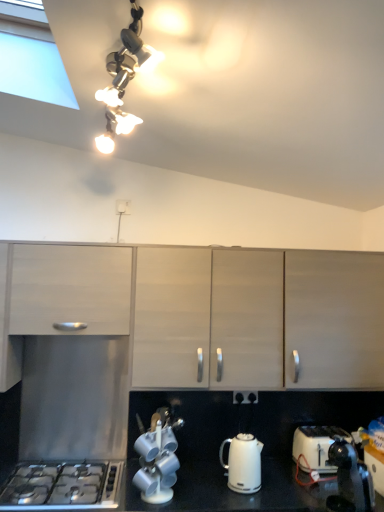
This screenshot has width=384, height=512. Describe the element at coordinates (157, 457) in the screenshot. I see `metallic silver tea set at lower center` at that location.

You are a GUI agent. You are given a task and a screenshot of the screen. Output one action in this format:
    pyautogui.click(x=<x>, y=<y>)
    Task: Click on the white glossy electric kettle at lower center
    
    Given the screenshot: What is the action you would take?
    pyautogui.click(x=243, y=463)

Locate an element on the screen. stainless steel gas stove at lower left is located at coordinates (62, 486).

Considering the sizes of objects white plastic toaster at lower right and white plastic electric outlet at center, placed as the second electric outlet when sorted from bottom to top, in the image provided, who is taller, white plastic toaster at lower right or white plastic electric outlet at center, placed as the second electric outlet when sorted from bottom to top,?

Standing taller between the two is white plastic toaster at lower right.

Is white plastic toaster at lower right surrounding white plastic electric outlet at center, which is the first electric outlet from top to bottom?

No.

Is there a large distance between white plastic toaster at lower right and white plastic electric outlet at center, placed as the second electric outlet when sorted from bottom to top?

white plastic toaster at lower right is positioned a significant distance from white plastic electric outlet at center, placed as the second electric outlet when sorted from bottom to top.

From a real-world perspective, is white plastic toaster at lower right physically located above or below matte wood cabinet at left, which is the 2th cabinetry in right-to-left order?

From a real-world perspective, white plastic toaster at lower right is physically below matte wood cabinet at left, which is the 2th cabinetry in right-to-left order.

Is white plastic toaster at lower right next to matte wood cabinet at left, which is the 2th cabinetry in right-to-left order, and touching it?

No, white plastic toaster at lower right is not in contact with matte wood cabinet at left, which is the 2th cabinetry in right-to-left order.

Considering the relative positions of white plastic toaster at lower right and matte wood cabinet at left, which is the 2th cabinetry in right-to-left order, in the image provided, is white plastic toaster at lower right to the right of matte wood cabinet at left, which is the 2th cabinetry in right-to-left order, from the viewer's perspective?

Indeed, white plastic toaster at lower right is positioned on the right side of matte wood cabinet at left, which is the 2th cabinetry in right-to-left order.

From a real-world perspective, which object stands above the other?

metallic chain lights at upper center, from a real-world perspective.

Is white plastic electric outlet at center, placed as the second electric outlet when sorted from bottom to top, inside or outside of metallic chain lights at upper center?

white plastic electric outlet at center, placed as the second electric outlet when sorted from bottom to top, cannot be found inside metallic chain lights at upper center.

Consider the image. Which of these two, white plastic electric outlet at center, the second electric outlet viewed from the right, or metallic chain lights at upper center, is thinner?

white plastic electric outlet at center, the second electric outlet viewed from the right.

How different are the orientations of white plastic electric outlet at center, marked as the 1th electric outlet in a left-to-right arrangement, and metallic chain lights at upper center in degrees?

85.6 degrees.

From the image's perspective, who appears lower, matte wood cabinet at left, which is the 2th cabinetry in right-to-left order, or black plastic electric outlet at center, placed as the 1th electric outlet when sorted from right to left?

black plastic electric outlet at center, placed as the 1th electric outlet when sorted from right to left, from the image's perspective.

Based on the photo, in terms of size, does matte wood cabinet at left, which is the 2th cabinetry in right-to-left order, appear bigger or smaller than black plastic electric outlet at center, which appears as the 2th electric outlet when viewed from the left?

Clearly, matte wood cabinet at left, which is the 2th cabinetry in right-to-left order, is larger in size than black plastic electric outlet at center, which appears as the 2th electric outlet when viewed from the left.

Can you confirm if metallic silver tea set at lower center is shorter than white glossy electric kettle at lower center?

No, metallic silver tea set at lower center is not shorter than white glossy electric kettle at lower center.

Is metallic silver tea set at lower center facing towards white glossy electric kettle at lower center?

No, metallic silver tea set at lower center is not turned towards white glossy electric kettle at lower center.

Where is `kitchen appliance behind the metallic silver tea set at lower center`? This screenshot has height=512, width=384. kitchen appliance behind the metallic silver tea set at lower center is located at coordinates (243, 463).

From the picture: Could you measure the distance between metallic silver tea set at lower center and white glossy electric kettle at lower center?

metallic silver tea set at lower center is 14.56 inches from white glossy electric kettle at lower center.

Is point (255, 326) less distant than point (219, 453)?

Yes, point (255, 326) is in front of point (219, 453).

Is matte wood cabinets at center, placed as the 1th cabinetry when sorted from right to left, not near white glossy electric kettle at lower center?

No, matte wood cabinets at center, placed as the 1th cabinetry when sorted from right to left, is in close proximity to white glossy electric kettle at lower center.

Can white glossy electric kettle at lower center be found inside matte wood cabinets at center, which is the 2th cabinetry in left-to-right order?

Actually, white glossy electric kettle at lower center is outside matte wood cabinets at center, which is the 2th cabinetry in left-to-right order.

Considering the sizes of matte wood cabinets at center, placed as the 1th cabinetry when sorted from right to left, and white glossy electric kettle at lower center in the image, is matte wood cabinets at center, placed as the 1th cabinetry when sorted from right to left, taller or shorter than white glossy electric kettle at lower center?

matte wood cabinets at center, placed as the 1th cabinetry when sorted from right to left, is taller than white glossy electric kettle at lower center.

Does white glossy electric kettle at lower center have a lesser width compared to metallic silver tea set at lower center?

No, white glossy electric kettle at lower center is not thinner than metallic silver tea set at lower center.

Is white glossy electric kettle at lower center oriented towards metallic silver tea set at lower center?

No, white glossy electric kettle at lower center is not turned towards metallic silver tea set at lower center.

Where is `tea set on the left of white glossy electric kettle at lower center`? tea set on the left of white glossy electric kettle at lower center is located at coordinates (157, 457).

From the image's perspective, is white glossy electric kettle at lower center below metallic silver tea set at lower center?

Yes.

Locate an element on the screen. This screenshot has height=512, width=384. toaster lying below the white plastic electric outlet at center, marked as the 1th electric outlet in a left-to-right arrangement (from the image's perspective) is located at coordinates (317, 446).

This screenshot has height=512, width=384. I want to click on toaster on the right of the matte wood cabinet at left, which is the 2th cabinetry in right-to-left order, so click(x=317, y=446).

Estimate the real-world distances between objects in this image. Which object is further from matte wood cabinet at left, which is the 2th cabinetry in right-to-left order, metallic chain lights at upper center or white plastic toaster at lower right?

white plastic toaster at lower right.

Based on their spatial positions, is stainless steel gas stove at lower left or black plastic electric outlet at center, the first electric outlet in the bottom-to-top sequence, closer to metallic silver tea set at lower center?

Among the two, stainless steel gas stove at lower left is located nearer to metallic silver tea set at lower center.

When comparing their distances from white glossy electric kettle at lower center, does metallic silver tea set at lower center or matte wood cabinet at left, which is counted as the first cabinetry, starting from the left, seem further?

matte wood cabinet at left, which is counted as the first cabinetry, starting from the left, is positioned further to the anchor white glossy electric kettle at lower center.

From the image, which object appears to be farther from white plastic electric outlet at center, the second electric outlet viewed from the right, white glossy electric kettle at lower center or black plastic electric outlet at center, placed as the 1th electric outlet when sorted from right to left?

The object further to white plastic electric outlet at center, the second electric outlet viewed from the right, is white glossy electric kettle at lower center.

Considering their positions, is white plastic toaster at lower right positioned closer to white glossy electric kettle at lower center than matte wood cabinets at center, which is the 2th cabinetry in left-to-right order?

white plastic toaster at lower right lies closer to white glossy electric kettle at lower center than the other object.

Considering their positions, is stainless steel gas stove at lower left positioned further to metallic silver tea set at lower center than white plastic electric outlet at center, which is the first electric outlet from top to bottom?

The object further to metallic silver tea set at lower center is white plastic electric outlet at center, which is the first electric outlet from top to bottom.

From the image, which object appears to be farther from matte wood cabinets at center, placed as the 1th cabinetry when sorted from right to left, black plastic electric outlet at center, which appears as the 2th electric outlet when viewed from the left, or white glossy electric kettle at lower center?

The object further to matte wood cabinets at center, placed as the 1th cabinetry when sorted from right to left, is black plastic electric outlet at center, which appears as the 2th electric outlet when viewed from the left.

When comparing their distances from stainless steel gas stove at lower left, does metallic chain lights at upper center or metallic silver tea set at lower center seem closer?

metallic silver tea set at lower center lies closer to stainless steel gas stove at lower left than the other object.

The height and width of the screenshot is (512, 384). I want to click on electric outlet between white plastic electric outlet at center, the second electric outlet viewed from the right, and white plastic toaster at lower right vertically, so click(245, 397).

The width and height of the screenshot is (384, 512). Find the location of `tea set between matte wood cabinets at center, placed as the 1th cabinetry when sorted from right to left, and white glossy electric kettle at lower center from top to bottom`. tea set between matte wood cabinets at center, placed as the 1th cabinetry when sorted from right to left, and white glossy electric kettle at lower center from top to bottom is located at coordinates (157, 457).

Identify the location of tea set between metallic chain lights at upper center and white plastic toaster at lower right from top to bottom. (157, 457).

I want to click on toaster between metallic chain lights at upper center and stainless steel gas stove at lower left in the vertical direction, so click(317, 446).